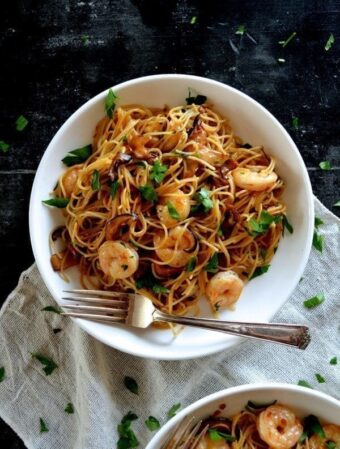
I want to click on kitchen towel, so click(x=210, y=378).